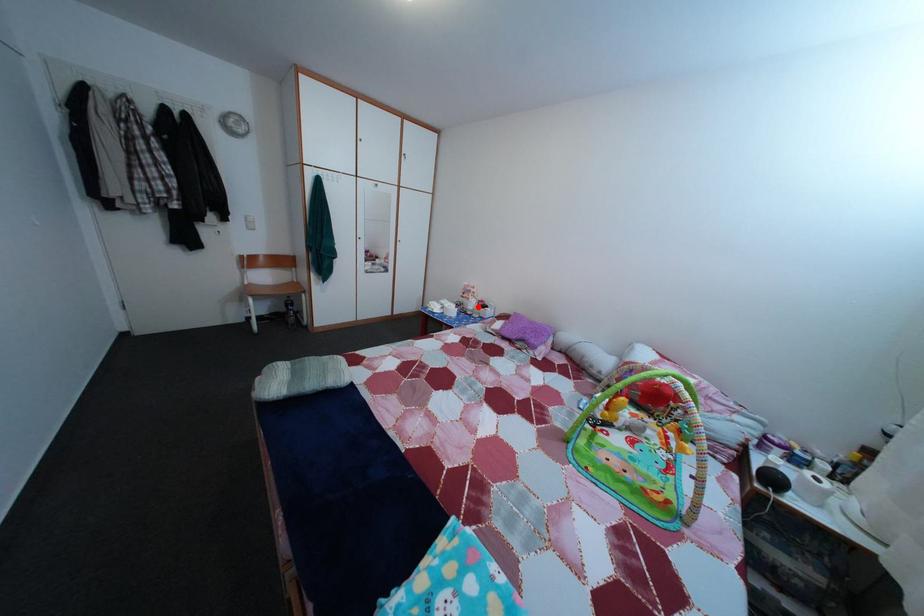
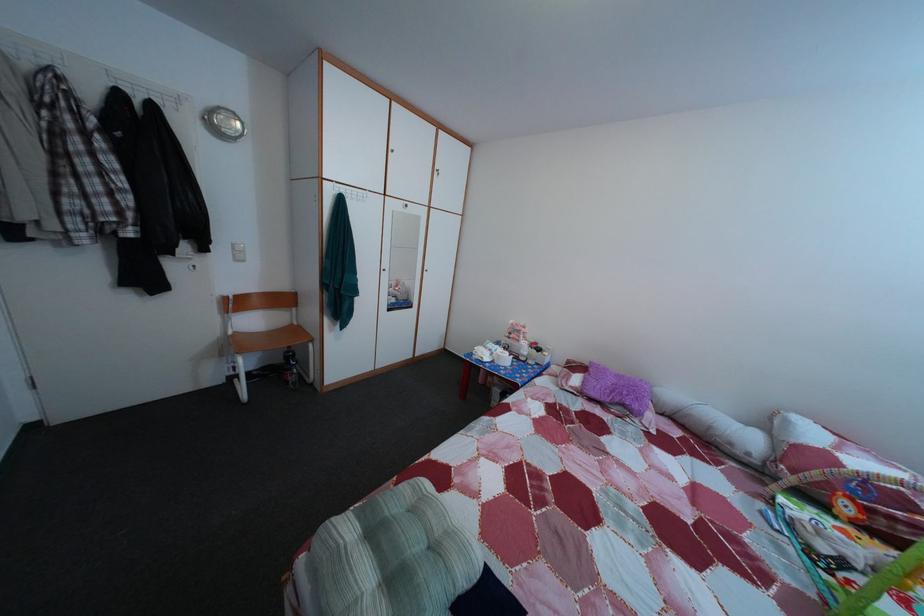
Where in the second image is the point corresponding to the highlighted location from the first image?

(528, 349)